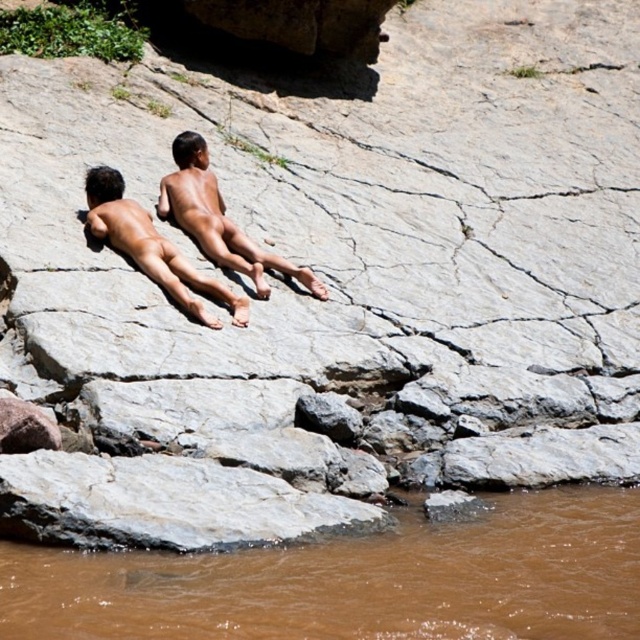
You are standing at the origin point in the image. Where is the matte skin man at center located in terms of coordinates?

The matte skin man at center is located at coordinates point (218,218).

You are standing at the edge of the water and want to reach the brown skin boy at center without getting into the brown muddy water at lower left. What is the shortest distance you can walk to avoid the water?

The shortest distance you can walk to avoid the brown muddy water at lower left and reach the brown skin boy at center is 21.69 feet, which is the direct path between them as the water is positioned at the lower left and the boy is at the center.

You are a photographer standing behind the two individuals at the rocky riverbank. You want to take a photo that includes both the matte skin man at center and the brown skin boy at center. Which individual will appear closer to the camera in the photo?

The matte skin man at center will appear closer to the camera in the photo because he is positioned further to the viewer compared to the brown skin boy at center.